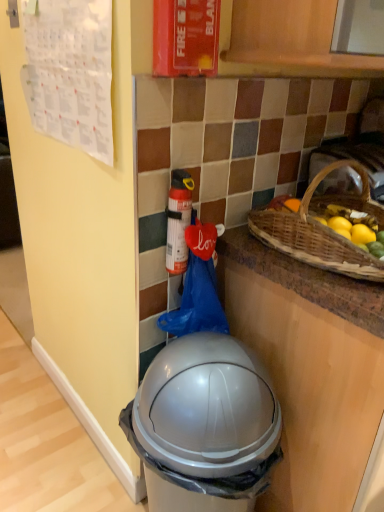
Question: Choose the correct answer: Is red matte fire extinguisher at upper center inside red matte fire extinguisher at center or outside it?

Choices:
 (A) outside
 (B) inside

Answer: (A)

Question: Considering the positions of red matte fire extinguisher at upper center and red matte fire extinguisher at center in the image, is red matte fire extinguisher at upper center wider or thinner than red matte fire extinguisher at center?

Choices:
 (A) thin
 (B) wide

Answer: (A)

Question: Which object is positioned farthest from the brown woven picnic basket at upper right?

Choices:
 (A) red matte fire extinguisher at upper center
 (B) silver plastic trash can at lower center
 (C) red matte fire extinguisher at center

Answer: (A)

Question: Which of these objects is positioned closest to the silver plastic trash can at lower center?

Choices:
 (A) brown woven picnic basket at upper right
 (B) red matte fire extinguisher at upper center
 (C) red matte fire extinguisher at center

Answer: (C)